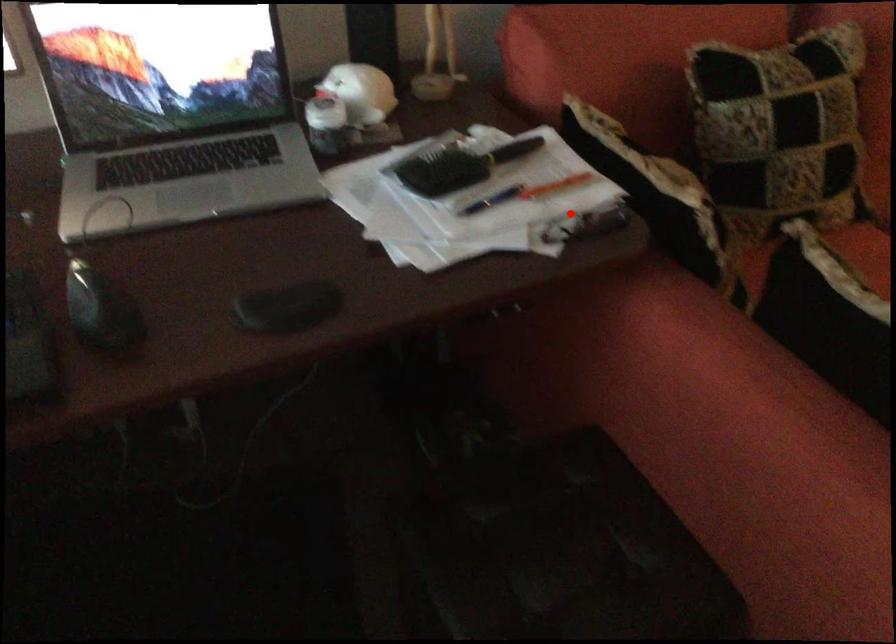
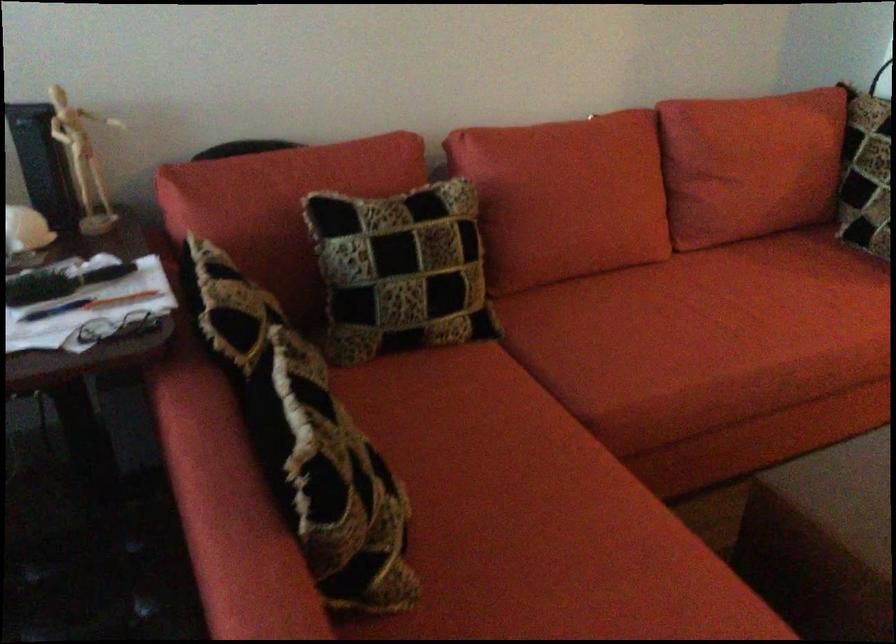
The point at the highlighted location is marked in the first image. Where is the corresponding point in the second image?

(119, 328)